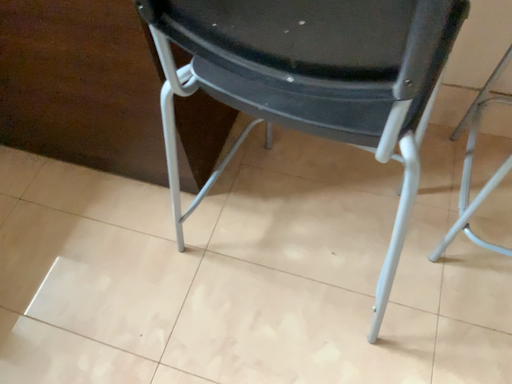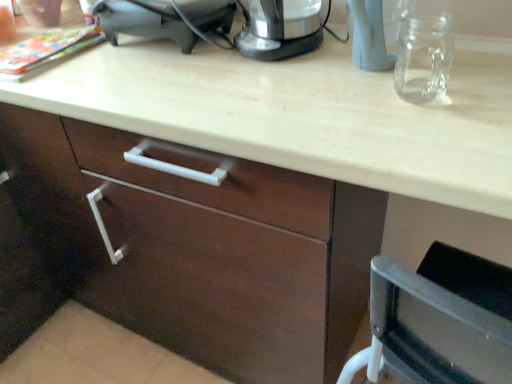
Question: Which way did the camera rotate in the video?

Choices:
 (A) rotated upward
 (B) rotated downward

Answer: (A)